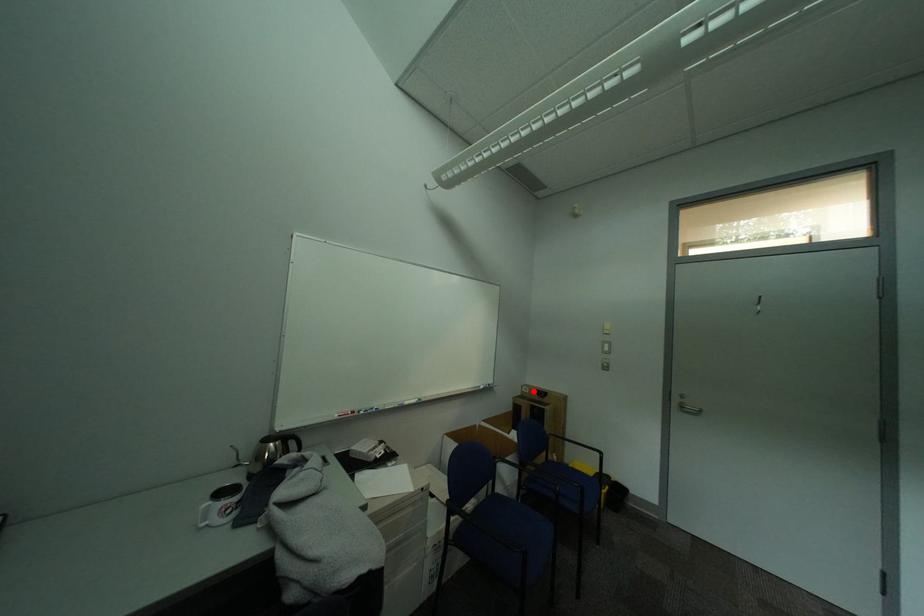
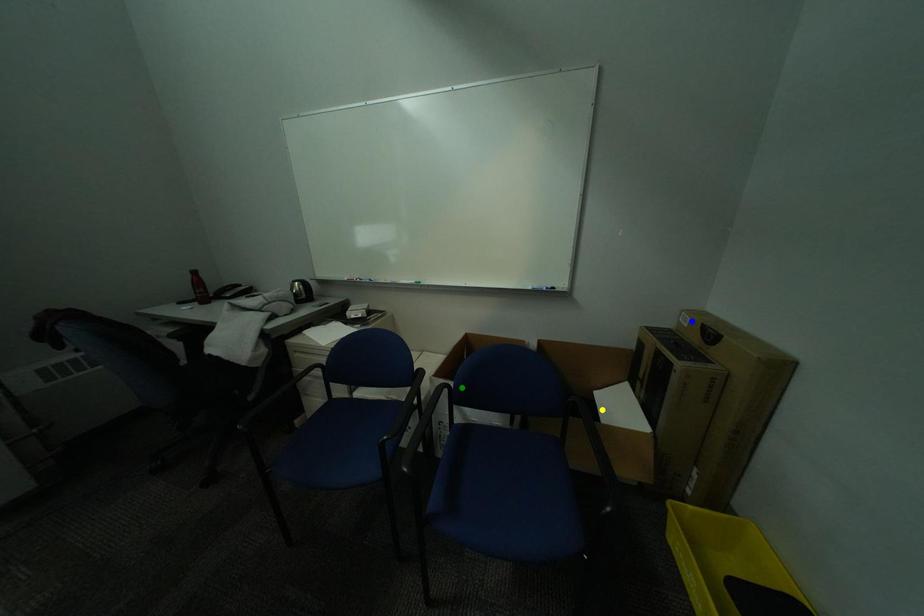
Question: I am providing you with two images of the same scene from different viewpoints. A red point is marked on the first image. You are given multiple points on the second image. Which point in image 2 represents the same 3d spot as the red point in image 1?

Choices:
 (A) green point
 (B) blue point
 (C) yellow point

Answer: (B)